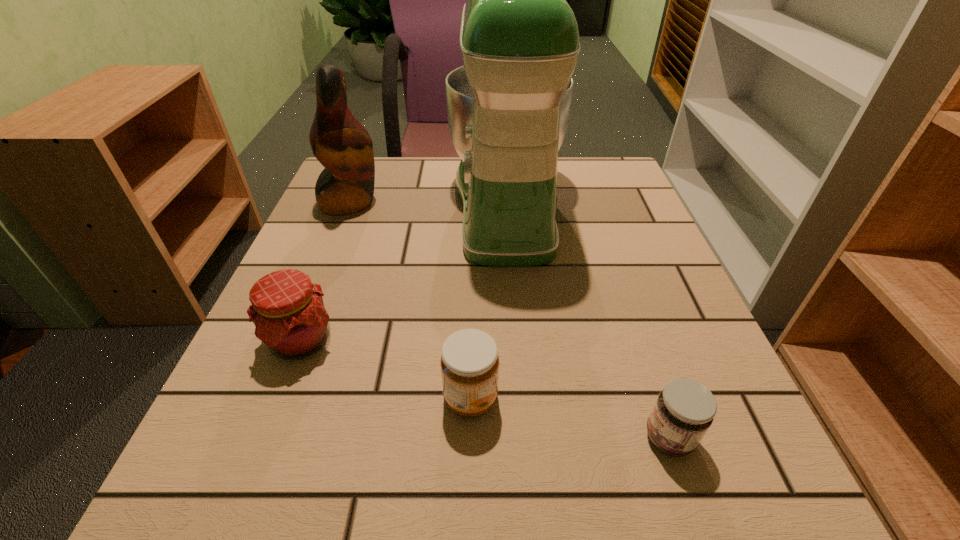
Find the location of a particular element. This screenshot has height=540, width=960. free space located 0.080m on the face of the fourth shortest object is located at coordinates (416, 201).

The width and height of the screenshot is (960, 540). In order to click on free space located 0.240m on the right of the leftmost jam in this screenshot , I will do [x=485, y=340].

Identify the location of free location located on the front label of the second jam from right to left. The width and height of the screenshot is (960, 540). point(574,398).

Find the location of a particular element. Image resolution: width=960 pixels, height=540 pixels. free point located on the front label of the shortest object is located at coordinates (414, 437).

Find the location of a particular element. blank space located on the front label of the shortest object is located at coordinates (540, 437).

Find the location of `vacant space located 0.320m on the front label of the shortest object`. vacant space located 0.320m on the front label of the shortest object is located at coordinates (407, 437).

At what (x,y) coordinates should I click in order to perform the action: click on mixer situated at the far edge. Please return your answer as a coordinate pair (x, y). Looking at the image, I should click on [x=508, y=107].

Where is `parrot present at the far edge`? parrot present at the far edge is located at coordinates (339, 141).

Identify the location of object situated at the near edge. The image size is (960, 540). (685, 409).

The height and width of the screenshot is (540, 960). I want to click on parrot that is at the left edge, so click(339, 141).